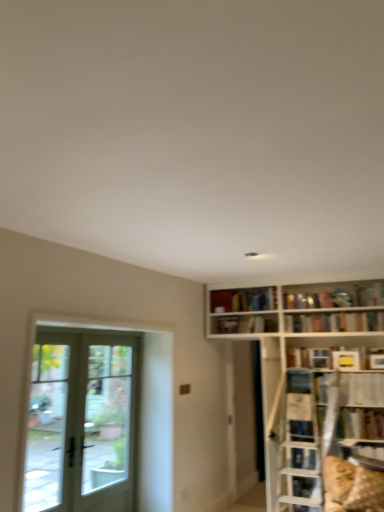
Describe the element at coordinates (346, 360) in the screenshot. I see `yellow matte bookshelf at upper right, positioned as the second book in bottom-to-top order` at that location.

Describe the element at coordinates (228, 325) in the screenshot. I see `white matte bookshelf at upper center, the fifth book when ordered from right to left` at that location.

This screenshot has width=384, height=512. What are the coordinates of `clear glass door at left` in the screenshot? It's located at (46, 425).

You are a GUI agent. You are given a task and a screenshot of the screen. Output one action in this format:
    pyautogui.click(x=<x>, y=<y>)
    Task: Click on the hardcover book at upper right, which ranks as the third book in right-to-left order
    Image resolution: width=384 pixels, height=512 pixels.
    Given the screenshot: What is the action you would take?
    pyautogui.click(x=308, y=300)

Find the location of a particular element. The image size is (384, 512). white glass door at left is located at coordinates (82, 422).

Image resolution: width=384 pixels, height=512 pixels. What do you see at coordinates (82, 422) in the screenshot?
I see `white glass door at left` at bounding box center [82, 422].

Identify the location of white plastic shelf at upper right. (362, 389).

The image size is (384, 512). What do you see at coordinates (362, 389) in the screenshot?
I see `white plastic shelf at upper right` at bounding box center [362, 389].

Identify the location of matte white bookshelf at upper right, the 5th book positioned from the left. The image size is (384, 512). (370, 295).

Could you tell me if matte white bookshelf at upper right, the first book from the right, is turned towards white glass door at left?

No.

Who is bigger, matte white bookshelf at upper right, positioned as the 5th book in bottom-to-top order, or white glass door at left?

white glass door at left is bigger.

Which object is closer to the camera, matte white bookshelf at upper right, the first book from the right, or white glass door at left?

white glass door at left is more forward.

Starting from the white glass door at left, which book is the 5th one to the right? Please provide its 2D coordinates.

[(370, 295)]

Is clear glass door at left inside or outside of white matte bookshelf at upper center, the fifth book when ordered from right to left?

clear glass door at left is located beyond the bounds of white matte bookshelf at upper center, the fifth book when ordered from right to left.

How far apart are clear glass door at left and white matte bookshelf at upper center, the fifth book when ordered from right to left?

clear glass door at left and white matte bookshelf at upper center, the fifth book when ordered from right to left, are 1.58 meters apart from each other.

Considering the positions of objects clear glass door at left and white matte bookshelf at upper center, which is counted as the third book, starting from the top, in the image provided, who is behind, clear glass door at left or white matte bookshelf at upper center, which is counted as the third book, starting from the top,?

Positioned behind is white matte bookshelf at upper center, which is counted as the third book, starting from the top.

Would you consider clear glass door at left to be distant from white matte bookshelf at upper center, which ranks as the first book in left-to-right order?

Yes, clear glass door at left and white matte bookshelf at upper center, which ranks as the first book in left-to-right order, are quite far apart.

Is matte white bookshelf at upper right, positioned as the 5th book in bottom-to-top order, closer to the viewer compared to hardcover book at upper right, the fourth book from the bottom?

Yes.

Is matte white bookshelf at upper right, acting as the first book starting from the top, situated inside hardcover book at upper right, which ranks as the 2th book in top-to-bottom order, or outside?

matte white bookshelf at upper right, acting as the first book starting from the top, is not enclosed by hardcover book at upper right, which ranks as the 2th book in top-to-bottom order.

Is matte white bookshelf at upper right, positioned as the 5th book in bottom-to-top order, positioned with its back to hardcover book at upper right, which is the 3th book from left to right?

No, matte white bookshelf at upper right, positioned as the 5th book in bottom-to-top order, is not facing away from hardcover book at upper right, which is the 3th book from left to right.

From a real-world perspective, is matte white bookshelf at upper right, the first book from the right, positioned above or below hardcover book at upper right, the fourth book from the bottom?

matte white bookshelf at upper right, the first book from the right, is situated higher than hardcover book at upper right, the fourth book from the bottom, in the real world.

Are hardcover book at upper right, which is the 3th book from left to right, and white plastic shelf at upper right making contact?

hardcover book at upper right, which is the 3th book from left to right, and white plastic shelf at upper right are clearly separated.

From a real-world perspective, which book is the 4th one above the white plastic shelf at upper right? Please provide its 2D coordinates.

[(308, 300)]

How distant is hardcover book at upper right, which ranks as the third book in right-to-left order, from white plastic shelf at upper right?

hardcover book at upper right, which ranks as the third book in right-to-left order, and white plastic shelf at upper right are 33.95 inches apart.

Does hardcover book at upper right, the fourth book from the bottom, have a lesser width compared to white plastic shelf at upper right?

Indeed, hardcover book at upper right, the fourth book from the bottom, has a lesser width compared to white plastic shelf at upper right.

Is point (349, 505) closer or farther from the camera than point (219, 320)?

Point (349, 505) is positioned closer to the camera compared to point (219, 320).

Can you confirm if patterned fabric pillow at lower right is thinner than white matte bookshelf at upper center, which is counted as the third book, starting from the top?

No, patterned fabric pillow at lower right is not thinner than white matte bookshelf at upper center, which is counted as the third book, starting from the top.

From the image's perspective, is patterned fabric pillow at lower right beneath white matte bookshelf at upper center, which is counted as the third book, starting from the top?

Correct, patterned fabric pillow at lower right appears lower than white matte bookshelf at upper center, which is counted as the third book, starting from the top, in the image.

Who is shorter, patterned fabric pillow at lower right or white matte bookshelf at upper center, which ranks as the first book in left-to-right order?

white matte bookshelf at upper center, which ranks as the first book in left-to-right order.

Based on their sizes in the image, would you say patterned fabric pillow at lower right is bigger or smaller than yellow matte bookshelf at upper right, positioned as the second book in bottom-to-top order?

Considering their sizes, patterned fabric pillow at lower right takes up more space than yellow matte bookshelf at upper right, positioned as the second book in bottom-to-top order.

Which is in front, point (375, 472) or point (350, 359)?

The point (375, 472) is closer.

Does patterned fabric pillow at lower right have a greater width compared to yellow matte bookshelf at upper right, placed as the fourth book when sorted from left to right?

Yes, patterned fabric pillow at lower right is wider than yellow matte bookshelf at upper right, placed as the fourth book when sorted from left to right.

Is patterned fabric pillow at lower right next to yellow matte bookshelf at upper right, positioned as the second book in bottom-to-top order, and touching it?

No, patterned fabric pillow at lower right is not next to yellow matte bookshelf at upper right, positioned as the second book in bottom-to-top order.

Find the location of a particular element. This screenshot has height=512, width=384. book on the left of hardcover book at upper right, which is counted as the fourth book, starting from the right is located at coordinates (228, 325).

Is hardcover book at upper right, marked as the 1th book in a bottom-to-top arrangement, not within white matte bookshelf at upper center, which is counted as the third book, starting from the top?

Yes, hardcover book at upper right, marked as the 1th book in a bottom-to-top arrangement, is located beyond the bounds of white matte bookshelf at upper center, which is counted as the third book, starting from the top.

From the image's perspective, would you say hardcover book at upper right, which is counted as the fourth book, starting from the right, is shown under white matte bookshelf at upper center, marked as the 3th book in a bottom-to-top arrangement?

Yes, from the image's perspective, hardcover book at upper right, which is counted as the fourth book, starting from the right, is below white matte bookshelf at upper center, marked as the 3th book in a bottom-to-top arrangement.

From a real-world perspective, which object rests below the other?

hardcover book at upper right, marked as the 1th book in a bottom-to-top arrangement, is physically lower.

In the image, there is a matte white bookshelf at upper right, positioned as the 5th book in bottom-to-top order. Where is `door below it (from the image's perspective)`? The height and width of the screenshot is (512, 384). door below it (from the image's perspective) is located at coordinates (82, 422).

The width and height of the screenshot is (384, 512). I want to click on book that is the 1st one when counting rightward from the clear glass door at left, so click(x=228, y=325).

From the image, which object appears to be nearer to hardcover book at upper right, which is the second book from left to right, matte white bookshelf at upper right, the 5th book positioned from the left, or white matte bookshelf at upper center, marked as the 3th book in a bottom-to-top arrangement?

Based on the image, white matte bookshelf at upper center, marked as the 3th book in a bottom-to-top arrangement, appears to be nearer to hardcover book at upper right, which is the second book from left to right.

Based on their spatial positions, is white plastic shelf at upper right or white glass door at left further from yellow matte bookshelf at upper right, which appears as the fourth book when viewed from the top?

white glass door at left is further to yellow matte bookshelf at upper right, which appears as the fourth book when viewed from the top.

When comparing their distances from white matte bookshelf at upper center, which ranks as the first book in left-to-right order, does patterned fabric pillow at lower right or white glass door at left seem further?

patterned fabric pillow at lower right is further to white matte bookshelf at upper center, which ranks as the first book in left-to-right order.

Based on the photo, which object lies nearer to the anchor point white plastic shelf at upper right, hardcover book at upper right, the fourth book from the bottom, or clear glass door at left?

hardcover book at upper right, the fourth book from the bottom.

Based on their spatial positions, is hardcover book at upper right, which ranks as the 2th book in top-to-bottom order, or matte white bookshelf at upper right, acting as the first book starting from the top, further from white matte bookshelf at upper center, which is counted as the third book, starting from the top?

Among the two, matte white bookshelf at upper right, acting as the first book starting from the top, is located further to white matte bookshelf at upper center, which is counted as the third book, starting from the top.

Based on their spatial positions, is white matte bookshelf at upper center, marked as the 3th book in a bottom-to-top arrangement, or yellow matte bookshelf at upper right, which appears as the fourth book when viewed from the top, closer to clear glass door at left?

Based on the image, white matte bookshelf at upper center, marked as the 3th book in a bottom-to-top arrangement, appears to be nearer to clear glass door at left.

Looking at this image, from the image, which object appears to be farther from hardcover book at upper right, which ranks as the third book in right-to-left order, white glass door at left or hardcover book at upper right, which is counted as the fourth book, starting from the right?

white glass door at left lies further to hardcover book at upper right, which ranks as the third book in right-to-left order, than the other object.

When comparing their distances from patterned fabric pillow at lower right, does hardcover book at upper right, which is the 3th book from left to right, or white plastic shelf at upper right seem further?

hardcover book at upper right, which is the 3th book from left to right, is further to patterned fabric pillow at lower right.

At what (x,y) coordinates should I click in order to perform the action: click on pillow situated between white glass door at left and white plastic shelf at upper right from left to right. Please return your answer as a coordinate pair (x, y). Looking at the image, I should click on (366, 490).

You are a GUI agent. You are given a task and a screenshot of the screen. Output one action in this format:
    pyautogui.click(x=<x>, y=<y>)
    Task: Click on the pillow located between white glass door at left and yellow matte bookshelf at upper right, marked as the second book in a right-to-left arrangement, in the left-right direction
    This screenshot has height=512, width=384.
    Given the screenshot: What is the action you would take?
    pyautogui.click(x=366, y=490)

The height and width of the screenshot is (512, 384). Find the location of `shelf that lies between matte white bookshelf at upper right, the 5th book positioned from the left, and patterned fabric pillow at lower right from top to bottom`. shelf that lies between matte white bookshelf at upper right, the 5th book positioned from the left, and patterned fabric pillow at lower right from top to bottom is located at coordinates (362, 389).

Where is `door located between clear glass door at left and yellow matte bookshelf at upper right, placed as the fourth book when sorted from left to right, in the left-right direction`? door located between clear glass door at left and yellow matte bookshelf at upper right, placed as the fourth book when sorted from left to right, in the left-right direction is located at coordinates (82, 422).